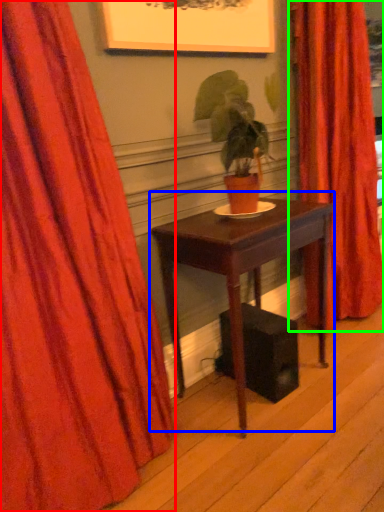
Question: Based on their relative distances, which object is farther from curtain (highlighted by a red box)? Choose from table (highlighted by a blue box) and curtain (highlighted by a green box).

Choices:
 (A) table
 (B) curtain

Answer: (B)